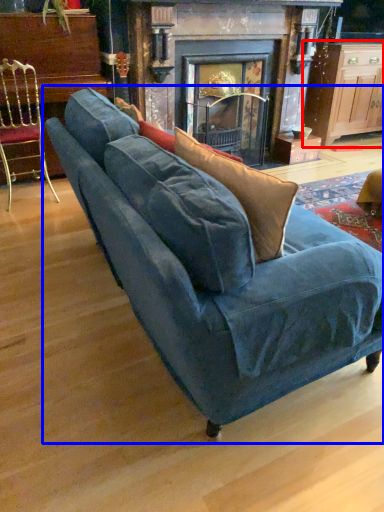
Question: Which of the following is the farthest to the observer, table (highlighted by a red box) or studio couch (highlighted by a blue box)?

Choices:
 (A) table
 (B) studio couch

Answer: (A)